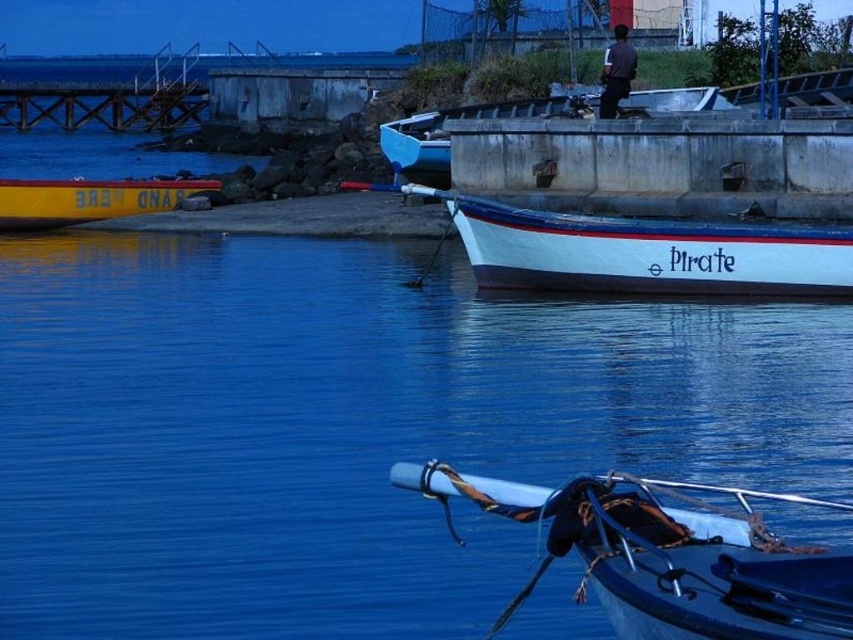
From the picture: Does white matte boat at center appear under yellow matte boat at left?

Yes, white matte boat at center is below yellow matte boat at left.

Measure the distance between point (456, 216) and camera.

A distance of 25.87 meters exists between point (456, 216) and camera.

Between point (677, 278) and point (26, 200), which one is positioned behind?

The point (26, 200) is behind.

In order to click on white matte boat at center in this screenshot , I will do tap(648, 252).

Can you confirm if metallic blue boat at lower right is wider than white matte boat at center?

No, metallic blue boat at lower right is not wider than white matte boat at center.

Measure the distance between metallic blue boat at lower right and camera.

metallic blue boat at lower right and camera are 8.78 meters apart.

Who is more distant from viewer, (585, 529) or (821, 237)?

Point (821, 237)

Where is `metallic blue boat at lower right`? metallic blue boat at lower right is located at coordinates (668, 556).

Is white matte boat at upper center positioned behind metallic blue boat at lower right?

Yes, white matte boat at upper center is further from the viewer.

The height and width of the screenshot is (640, 853). What do you see at coordinates (350, 428) in the screenshot?
I see `white matte boat at upper center` at bounding box center [350, 428].

Is point (511, 621) positioned in front of point (619, 634)?

No, (511, 621) is further to viewer.

I want to click on white matte boat at upper center, so click(350, 428).